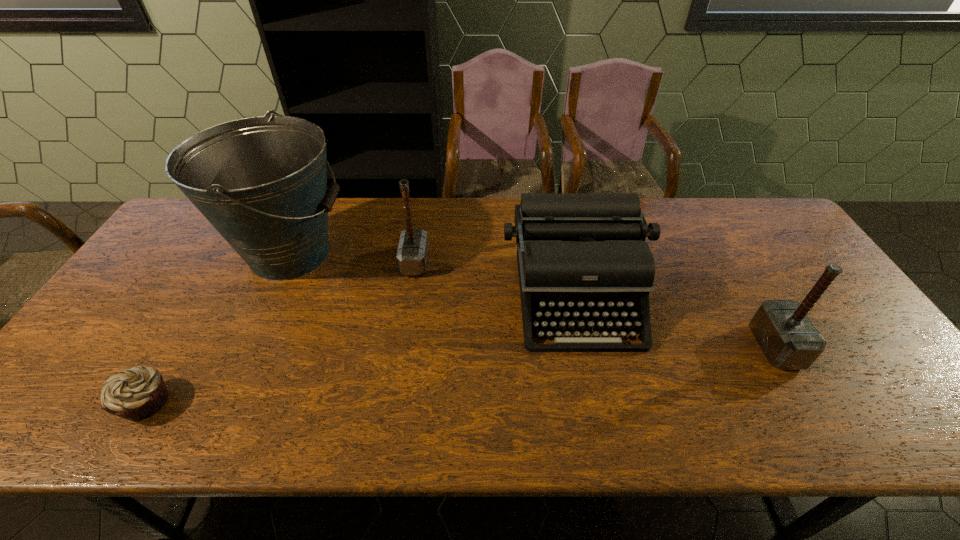
This screenshot has width=960, height=540. Find the location of `bucket`. bucket is located at coordinates click(261, 181).

Locate an element on the screen. the third object from left to right is located at coordinates (412, 254).

Locate an element on the screen. The image size is (960, 540). the left hammer is located at coordinates (412, 254).

Find the location of a particular element. the rightmost object is located at coordinates (788, 338).

Image resolution: width=960 pixels, height=540 pixels. I want to click on the right hammer, so click(x=788, y=338).

You are a GUI agent. You are given a task and a screenshot of the screen. Output one action in this format:
    pyautogui.click(x=<x>, y=<y>)
    Task: Click on the typewriter
    This screenshot has width=960, height=540.
    Given the screenshot: What is the action you would take?
    pyautogui.click(x=580, y=255)

The image size is (960, 540). Find the location of `the fourth tallest object`. the fourth tallest object is located at coordinates (580, 255).

The width and height of the screenshot is (960, 540). In order to click on the shortest object in this screenshot , I will do `click(138, 393)`.

Where is `the nearest object`? the nearest object is located at coordinates (138, 393).

This screenshot has height=540, width=960. In order to click on vacant space located 0.060m with the handle on opposite sides of the bucket in this screenshot , I will do `click(372, 254)`.